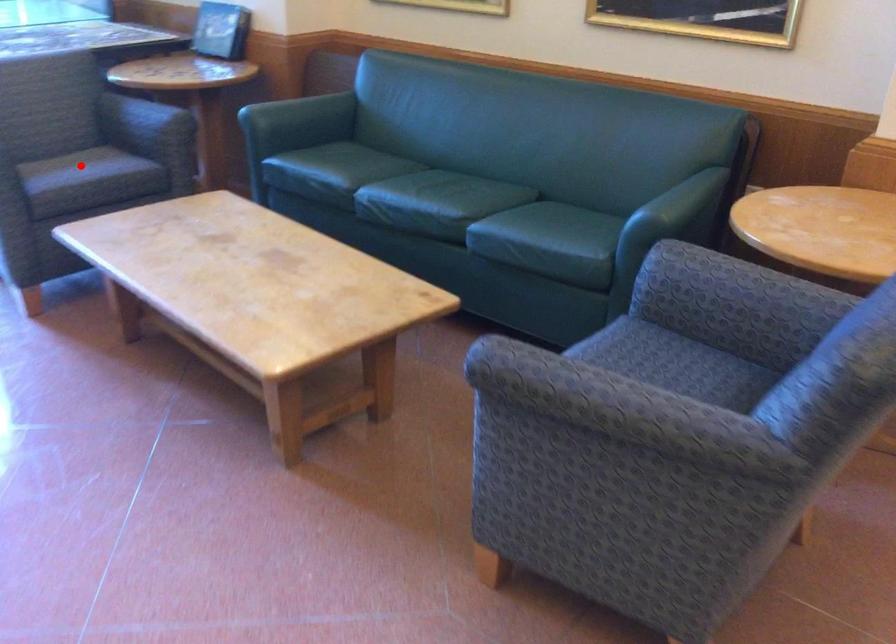
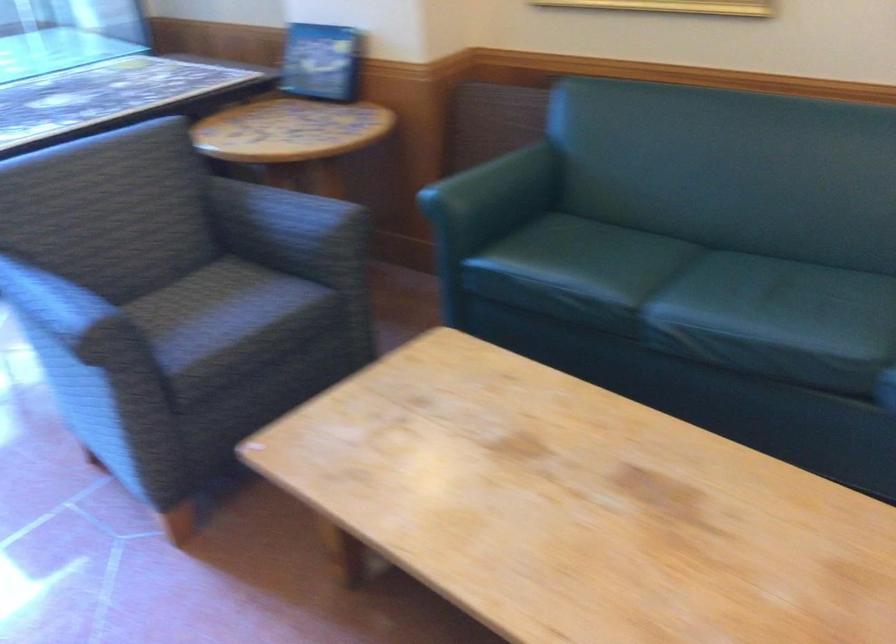
Where in the second image is the point corresponding to the highlighted location from the first image?

(224, 317)